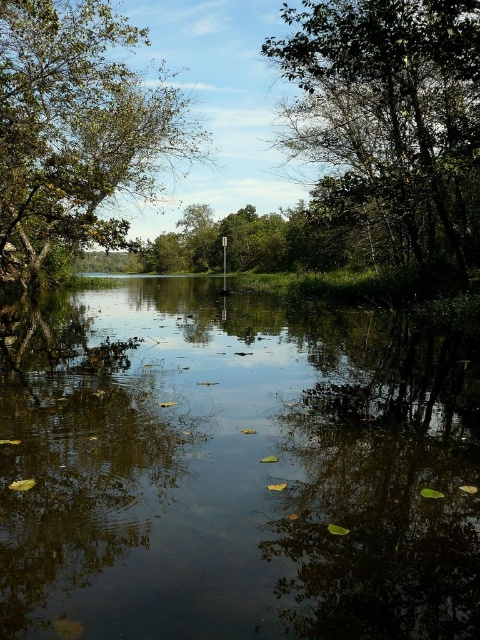
Question: Which object is closer to the camera taking this photo?

Choices:
 (A) dark reflective water at center
 (B) green leafy tree at upper left
 (C) green leafy tree at upper right

Answer: (A)

Question: Which is nearer to the green leafy tree at upper right?

Choices:
 (A) dark reflective water at center
 (B) green leafy tree at upper left

Answer: (A)

Question: Is dark reflective water at center closer to camera compared to green leafy tree at upper left?

Choices:
 (A) yes
 (B) no

Answer: (A)

Question: Is green leafy tree at upper right bigger than green leafy tree at upper left?

Choices:
 (A) yes
 (B) no

Answer: (A)

Question: Is green leafy tree at upper right in front of green leafy tree at upper left?

Choices:
 (A) yes
 (B) no

Answer: (A)

Question: Which object is closer to the camera taking this photo?

Choices:
 (A) dark reflective water at center
 (B) green leafy tree at upper left

Answer: (A)